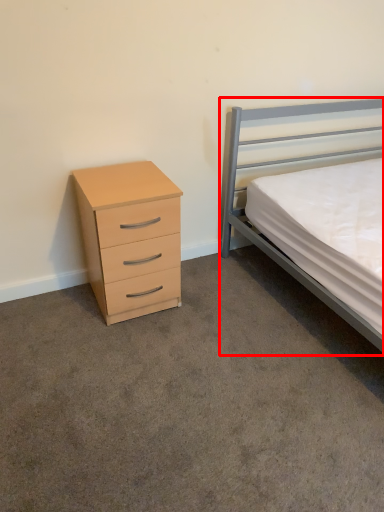
Question: From the image's perspective, where is bed (annotated by the red box) located in relation to chest of drawers in the image?

Choices:
 (A) above
 (B) below

Answer: (A)